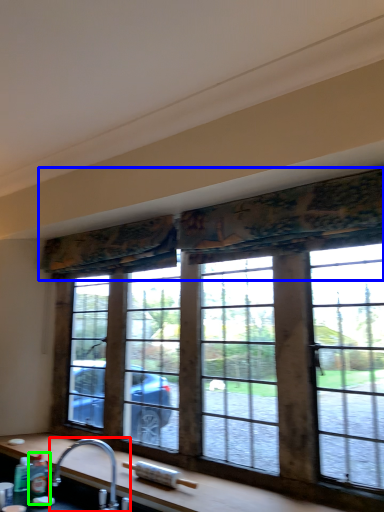
Question: Which object is the farthest from tap (highlighted by a red box)? Choose among these: curtain (highlighted by a blue box) or bottle (highlighted by a green box).

Choices:
 (A) curtain
 (B) bottle

Answer: (A)